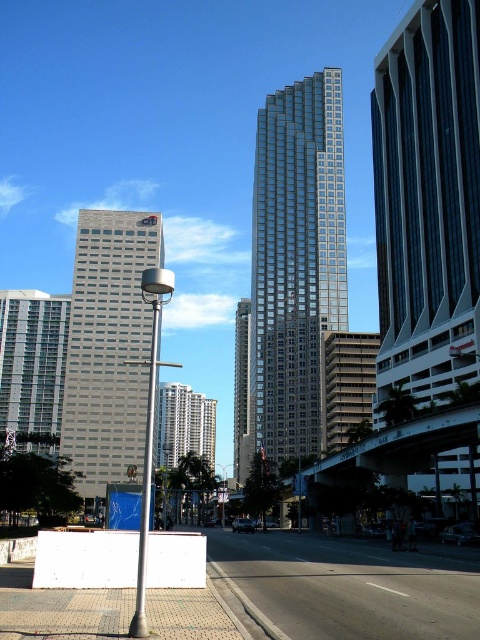
Question: Which object is positioned closest to the gray concrete pavement at lower center?

Choices:
 (A) white glass building at left
 (B) gray brick pavement at lower left

Answer: (B)

Question: Does glassy steel skyscraper at center have a lesser width compared to glassy reflective skyscraper at center?

Choices:
 (A) no
 (B) yes

Answer: (A)

Question: Which is nearer to the glassy steel skyscraper at center?

Choices:
 (A) glassy reflective skyscraper at right
 (B) silver metallic pole at left
 (C) glassy reflective skyscraper at center

Answer: (C)

Question: Can you confirm if gray concrete pavement at lower center is positioned to the left of gray brick pavement at lower left?

Choices:
 (A) yes
 (B) no

Answer: (B)

Question: Considering the real-world distances, which object is closest to the gray concrete pavement at lower center?

Choices:
 (A) glassy reflective skyscraper at center
 (B) silver metallic pole at left
 (C) gray concrete building at center
 (D) white glass building at left

Answer: (B)

Question: Is glassy steel skyscraper at center wider than glassy reflective skyscraper at center?

Choices:
 (A) no
 (B) yes

Answer: (B)